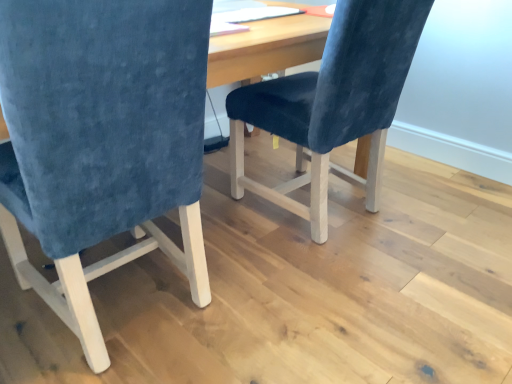
Find the location of a particular element. vacant space to the right of velvet blue chair at center, which is the 2th chair from left to right is located at coordinates (439, 209).